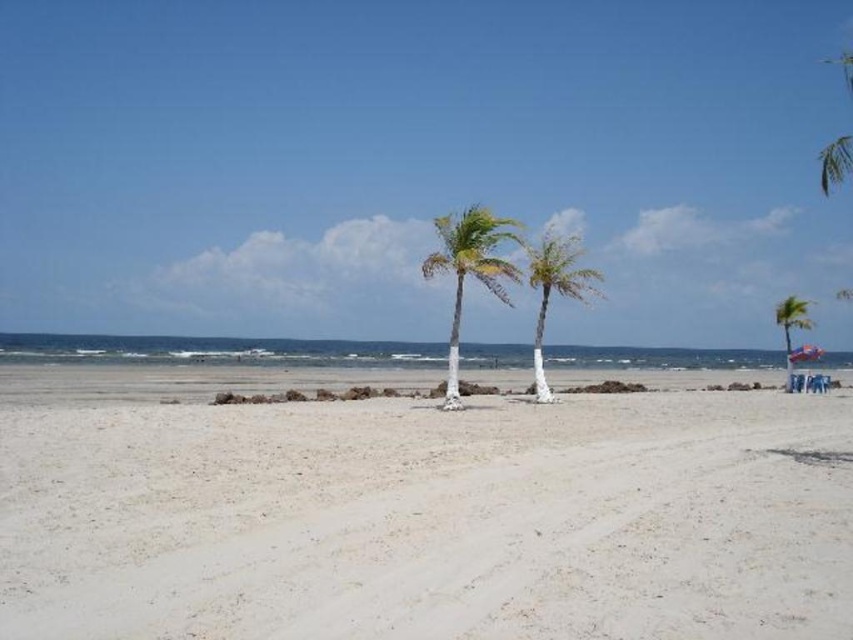
You are standing on the beach and want to take a photo of both the white painted wood palm tree at center and the green leafy palm tree at right. Which tree should you position closer to the camera to ensure both are fully visible in the frame?

You should position the white painted wood palm tree at center closer to the camera because it is in front of the green leafy palm tree at right, so placing it nearer will keep both trees within the frame without one being obscured.

You are standing at the point marked by the coordinates point [430,518] in the image. What is the name of the location you are currently standing on?

The point [430,518] indicates white sandy beach at center.